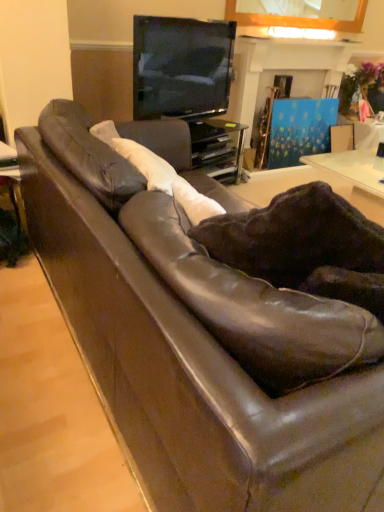
Question: Is black glass entertainment center at upper center not within leather swivel chair at center?

Choices:
 (A) no
 (B) yes

Answer: (B)

Question: Considering the relative sizes of black glass entertainment center at upper center and leather swivel chair at center in the image provided, is black glass entertainment center at upper center taller than leather swivel chair at center?

Choices:
 (A) no
 (B) yes

Answer: (A)

Question: Can you confirm if black glass entertainment center at upper center is wider than leather swivel chair at center?

Choices:
 (A) no
 (B) yes

Answer: (B)

Question: From a real-world perspective, does black glass entertainment center at upper center stand above leather swivel chair at center?

Choices:
 (A) no
 (B) yes

Answer: (A)

Question: From a real-world perspective, is black glass entertainment center at upper center below leather swivel chair at center?

Choices:
 (A) no
 (B) yes

Answer: (B)

Question: From a real-world perspective, is matte brown table at left physically located above or below matte black tv at upper center?

Choices:
 (A) above
 (B) below

Answer: (B)

Question: From the image's perspective, is matte brown table at left positioned above or below matte black tv at upper center?

Choices:
 (A) above
 (B) below

Answer: (B)

Question: Is matte brown table at left spatially inside matte black tv at upper center, or outside of it?

Choices:
 (A) outside
 (B) inside

Answer: (A)

Question: Based on their sizes in the image, would you say matte brown table at left is bigger or smaller than matte black tv at upper center?

Choices:
 (A) small
 (B) big

Answer: (A)

Question: Considering the positions of black glass entertainment center at upper center and blue painted wood fireplace at upper center in the image, is black glass entertainment center at upper center taller or shorter than blue painted wood fireplace at upper center?

Choices:
 (A) tall
 (B) short

Answer: (B)

Question: Considering the relative positions of black glass entertainment center at upper center and blue painted wood fireplace at upper center in the image provided, is black glass entertainment center at upper center to the left or to the right of blue painted wood fireplace at upper center?

Choices:
 (A) right
 (B) left

Answer: (B)

Question: From the image's perspective, is black glass entertainment center at upper center positioned above or below blue painted wood fireplace at upper center?

Choices:
 (A) above
 (B) below

Answer: (B)

Question: Is point (190, 162) positioned closer to the camera than point (322, 96)?

Choices:
 (A) closer
 (B) farther

Answer: (A)

Question: From a real-world perspective, relative to leather swivel chair at center, is black glass entertainment center at upper center vertically above or below?

Choices:
 (A) above
 (B) below

Answer: (B)

Question: From the image's perspective, is black glass entertainment center at upper center located above or below leather swivel chair at center?

Choices:
 (A) above
 (B) below

Answer: (A)